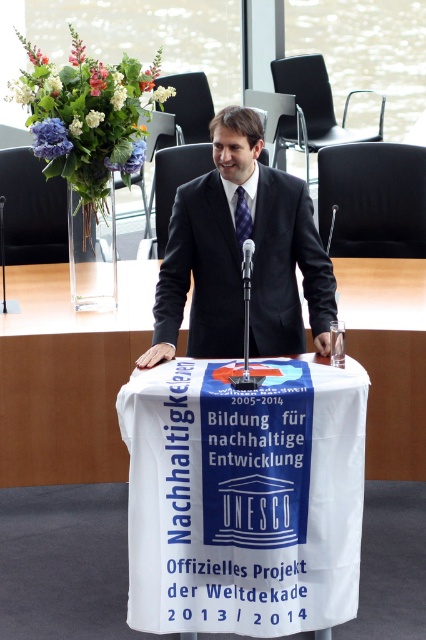
From the picture: Who is more forward, (239, 234) or (249, 280)?

Point (249, 280) is more forward.

This screenshot has width=426, height=640. I want to click on blue checkered tie at center, so click(x=241, y=216).

Is blue checkered tie at center bigger than black plastic microphone at center?

Incorrect, blue checkered tie at center is not larger than black plastic microphone at center.

In the scene shown: Can you confirm if blue checkered tie at center is wider than black plastic microphone at center?

Incorrect, blue checkered tie at center's width does not surpass black plastic microphone at center's.

Which is behind, point (239, 237) or point (333, 224)?

Positioned behind is point (333, 224).

The image size is (426, 640). In order to click on blue checkered tie at center in this screenshot , I will do `click(241, 216)`.

Measure the distance from white cloth-covered table at center to blue checkered tie at center.

white cloth-covered table at center and blue checkered tie at center are 1.29 meters apart.

Does white cloth-covered table at center appear on the right side of blue checkered tie at center?

Incorrect, white cloth-covered table at center is not on the right side of blue checkered tie at center.

Does point (115, 444) lie in front of point (249, 225)?

No, (115, 444) is behind (249, 225).

Locate an element on the screen. white cloth-covered table at center is located at coordinates (68, 376).